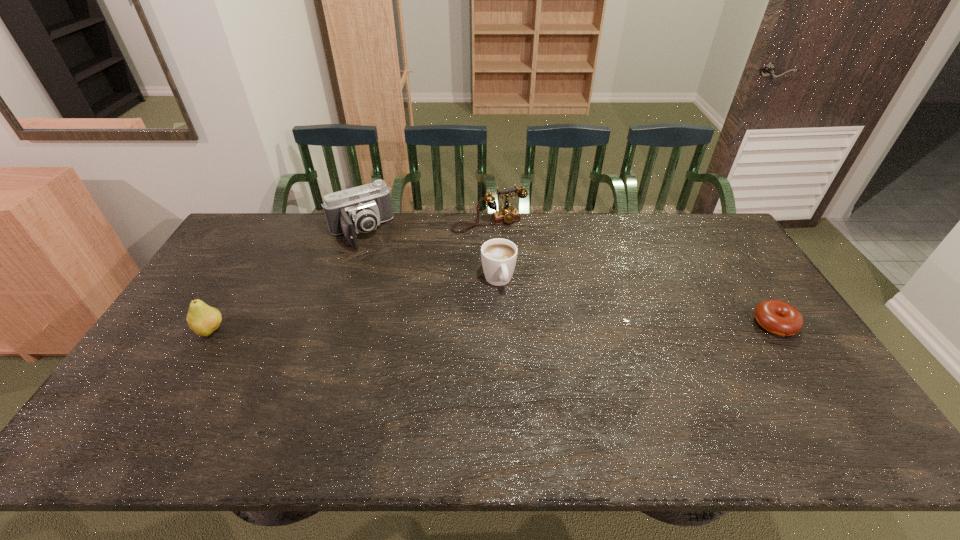
Find the location of a particular element. The width and height of the screenshot is (960, 540). object at the left edge is located at coordinates (203, 319).

Identify the location of object positioned at the right edge. This screenshot has width=960, height=540. (777, 317).

Find the location of a particular element. Image resolution: width=960 pixels, height=540 pixels. vacant area at the far edge is located at coordinates [582, 217].

Where is `free space at the near edge of the desktop`? Image resolution: width=960 pixels, height=540 pixels. free space at the near edge of the desktop is located at coordinates [718, 387].

In the image, there is a desktop. Identify the location of vacant area at the left edge. (133, 377).

This screenshot has width=960, height=540. I want to click on free spot at the right edge of the desktop, so click(731, 266).

This screenshot has height=540, width=960. I want to click on vacant space at the far left corner, so click(274, 219).

In the image, there is a desktop. Where is `vacant area at the far right corner`? This screenshot has height=540, width=960. vacant area at the far right corner is located at coordinates (686, 225).

In the image, there is a desktop. Find the location of `free region at the near right corner`. free region at the near right corner is located at coordinates (795, 392).

I want to click on vacant area that lies between the second shortest object and the camera, so click(429, 256).